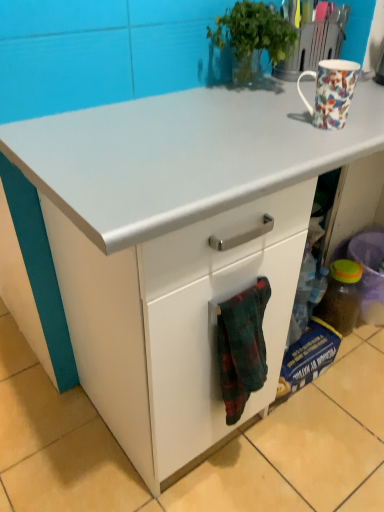
You are a GUI agent. You are given a task and a screenshot of the screen. Output one action in this format:
    pyautogui.click(x=<x>, y=<y>)
    Task: Click on the vacant point to the left of green leafy plant at upper center
    Image resolution: width=384 pixels, height=512 pixels.
    Given the screenshot: What is the action you would take?
    pyautogui.click(x=182, y=103)